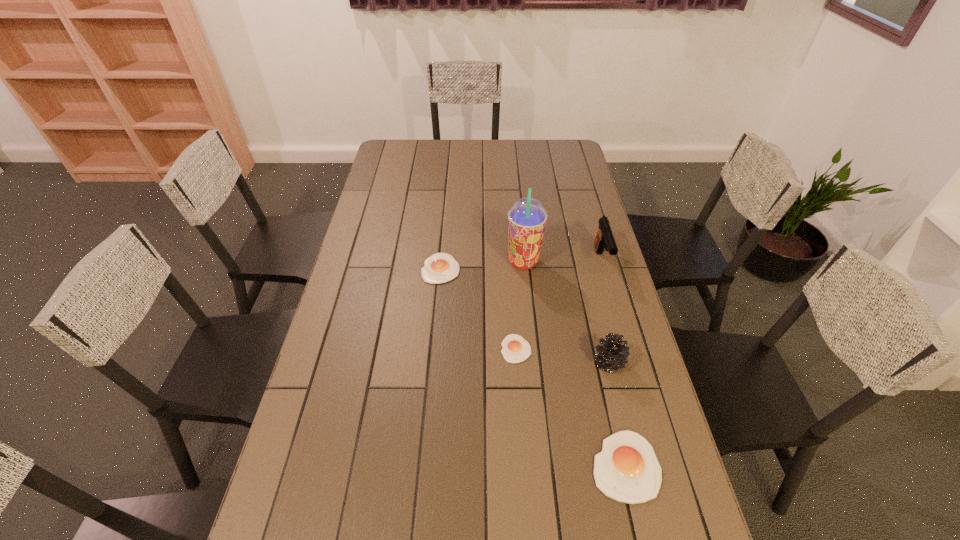
Locate an element on the screen. The height and width of the screenshot is (540, 960). vacant space that satisfies the following two spatial constraints: 1. on the back side of the rightmost egg yolk; 2. on the right side of the third tallest object is located at coordinates (602, 363).

Locate an element on the screen. This screenshot has width=960, height=540. vacant region that satisfies the following two spatial constraints: 1. on the front side of the tallest object; 2. on the right side of the nearest egg yolk is located at coordinates (544, 465).

This screenshot has height=540, width=960. I want to click on vacant space that satisfies the following two spatial constraints: 1. on the front side of the shortest egg yolk; 2. on the left side of the leftmost egg yolk, so click(x=433, y=349).